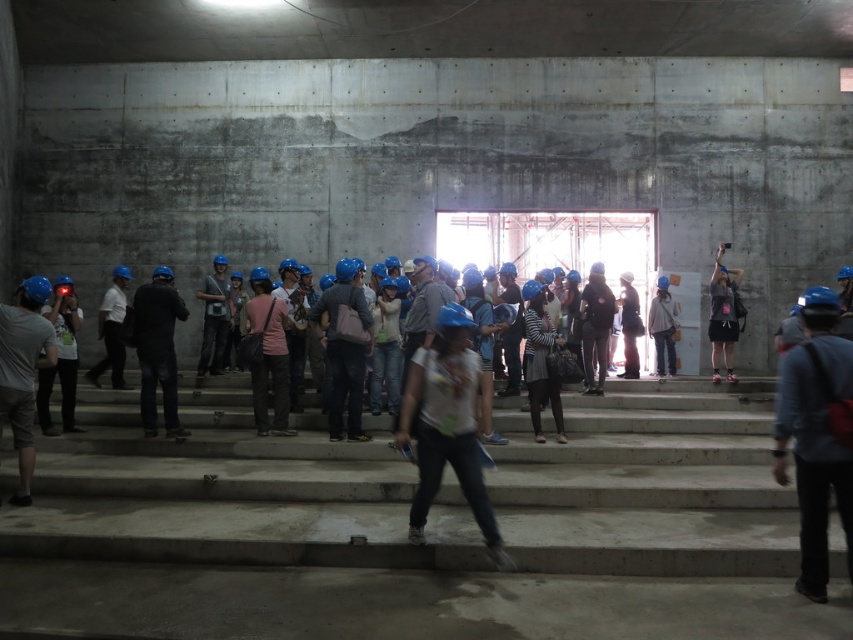
You are a construction worker who needs to store your matte blue helmet at center and matte black backpack at right in a locker that can hold items up to 30 cm wide. Based on the scene, can both items fit in the locker?

The matte blue helmet at center is narrower than the matte black backpack at right. Since the backpack is wider, but the locker can hold up to 30 cm, both items can fit as long as the backpack is under 30 cm. However, without knowing the exact width of the backpack, we can only confirm the helmet will fit.

Looking at this image, you are standing at the base of the concrete steps in the unfinished building. You see two points marked in the image. Which point, point (815, 522) or point (355, 285), is closer to you?

Point (815, 522) is closer to you than point (355, 285).